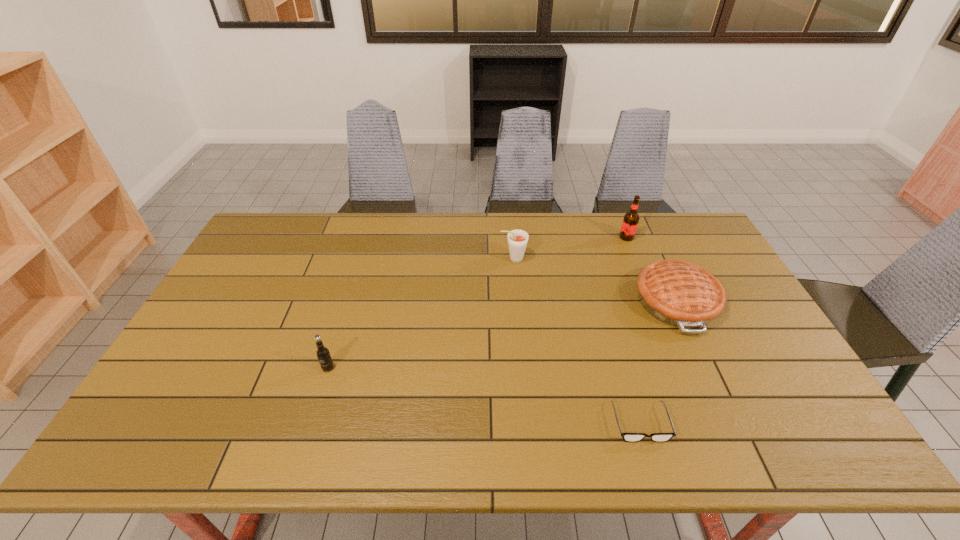
Where is `free space at the left edge of the desktop`? free space at the left edge of the desktop is located at coordinates (270, 273).

The image size is (960, 540). Find the location of `free location at the right edge of the desktop`. free location at the right edge of the desktop is located at coordinates (738, 305).

This screenshot has width=960, height=540. In order to click on vacant region at the far left corner of the desktop in this screenshot , I will do `click(264, 248)`.

At what (x,y) coordinates should I click in order to perform the action: click on free space at the far right corner of the desktop. Please return your answer as a coordinate pair (x, y). The image size is (960, 540). Looking at the image, I should click on (690, 218).

The image size is (960, 540). In order to click on free space between the second farthest root beer and the third object from left to right in this screenshot , I will do `click(577, 341)`.

The width and height of the screenshot is (960, 540). I want to click on free space between the leftmost root beer and the third nearest object, so click(502, 334).

Identify the location of free space between the spectacles and the rightmost root beer. 634,330.

Find the location of a particular element. Image resolution: width=960 pixels, height=540 pixels. vacant space in between the second nearest root beer and the farthest root beer is located at coordinates (570, 248).

At what (x,y) coordinates should I click in order to perform the action: click on free point between the fourth tallest object and the shortest object. Please return your answer as a coordinate pair (x, y). This screenshot has height=540, width=960. Looking at the image, I should click on (659, 362).

Locate an element on the screen. The width and height of the screenshot is (960, 540). unoccupied area between the nearest object and the fourth tallest object is located at coordinates (659, 362).